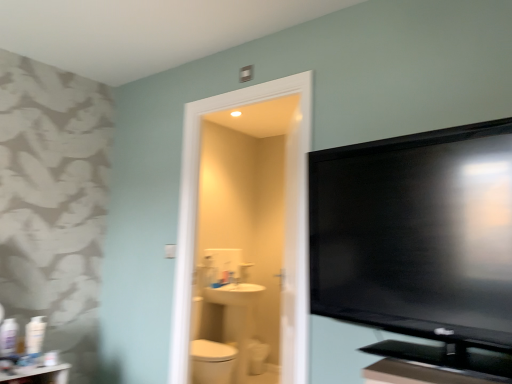
I want to click on white glossy toilet bowl at center, so (257, 356).

Identify the location of white plastic bottles at left, arranged as the second toiletry when viewed from the right. (8, 337).

Measure the distance between black glossy flat-screen tv at right and camera.

black glossy flat-screen tv at right is 1.14 meters from camera.

Measure the distance between point (494, 283) and camera.

Point (494, 283) is 3.83 feet away from camera.

In order to click on white glossy toilet bowl at center in this screenshot , I will do `click(257, 356)`.

Considering the sizes of white glossy toilet bowl at center and black glossy flat-screen tv at right in the image, is white glossy toilet bowl at center bigger or smaller than black glossy flat-screen tv at right?

Clearly, white glossy toilet bowl at center is smaller in size than black glossy flat-screen tv at right.

Is white glossy toilet bowl at center oriented towards black glossy flat-screen tv at right?

No, white glossy toilet bowl at center is not oriented towards black glossy flat-screen tv at right.

Is the surface of white glossy toilet bowl at center in direct contact with black glossy flat-screen tv at right?

No.

From a real-world perspective, between white plastic bottles at left, which appears as the 1th toiletry when viewed from the left, and white glossy sink at center, who is vertically higher?

From a 3D spatial view, white glossy sink at center is above.

Looking at this image, are white plastic bottles at left, arranged as the second toiletry when viewed from the right, and white glossy sink at center located far from each other?

That's right, there is a large distance between white plastic bottles at left, arranged as the second toiletry when viewed from the right, and white glossy sink at center.

Locate an element on the screen. The height and width of the screenshot is (384, 512). sink lying below the white plastic bottles at left, arranged as the second toiletry when viewed from the right (from the image's perspective) is located at coordinates click(x=232, y=292).

Which of these two, white plastic bottles at left, which appears as the 1th toiletry when viewed from the left, or white glossy sink at center, stands taller?

white plastic bottles at left, which appears as the 1th toiletry when viewed from the left.

In the image, is white plastic bottles at left, which appears as the 1th toiletry when viewed from the left, positioned in front of or behind white glossy toilet bowl at center?

Clearly, white plastic bottles at left, which appears as the 1th toiletry when viewed from the left, is in front of white glossy toilet bowl at center.

From a real-world perspective, is white plastic bottles at left, which appears as the 1th toiletry when viewed from the left, located beneath white glossy toilet bowl at center?

No, from a real-world perspective, white plastic bottles at left, which appears as the 1th toiletry when viewed from the left, is not below white glossy toilet bowl at center.

Who is bigger, white plastic bottles at left, arranged as the second toiletry when viewed from the right, or white glossy toilet bowl at center?

white glossy toilet bowl at center.

Identify the location of toilet bowl below the white plastic bottles at left, which appears as the 1th toiletry when viewed from the left (from a real-world perspective). Image resolution: width=512 pixels, height=384 pixels. (257, 356).

From the image's perspective, which one is positioned higher, white plastic bottles at left, which appears as the 1th toiletry when viewed from the left, or black glossy flat-screen tv at right?

A: black glossy flat-screen tv at right appears higher in the image.

Considering the positions of objects white plastic bottles at left, which appears as the 1th toiletry when viewed from the left, and black glossy flat-screen tv at right in the image provided, who is behind, white plastic bottles at left, which appears as the 1th toiletry when viewed from the left, or black glossy flat-screen tv at right?

white plastic bottles at left, which appears as the 1th toiletry when viewed from the left, is further away from the camera.

Considering the relative sizes of white plastic bottles at left, which appears as the 1th toiletry when viewed from the left, and black glossy flat-screen tv at right in the image provided, is white plastic bottles at left, which appears as the 1th toiletry when viewed from the left, shorter than black glossy flat-screen tv at right?

Yes.

From the image's perspective, which one is positioned higher, white glossy table at lower left or white glossy toilet bowl at center?

white glossy table at lower left appears higher in the image.

Is white glossy table at lower left wider or thinner than white glossy toilet bowl at center?

white glossy table at lower left is wider than white glossy toilet bowl at center.

Is white glossy table at lower left positioned behind white glossy toilet bowl at center?

No, the depth of white glossy table at lower left is less than that of white glossy toilet bowl at center.

Is white glossy table at lower left not close to white glossy toilet bowl at center?

Yes, white glossy table at lower left is far from white glossy toilet bowl at center.

Can you tell me how much white glossy sink at center and white plastic bottle at left, the 2th toiletry in the left-to-right sequence, differ in facing direction?

11.2 degrees separate the facing orientations of white glossy sink at center and white plastic bottle at left, the 2th toiletry in the left-to-right sequence.

How far apart are white glossy sink at center and white plastic bottle at left, the 1th toiletry from the right?

white glossy sink at center is 4.72 feet away from white plastic bottle at left, the 1th toiletry from the right.

From a real-world perspective, between white glossy sink at center and white plastic bottle at left, the 2th toiletry in the left-to-right sequence, who is vertically higher?

In real-world perspective, white glossy sink at center is above.

From the image's perspective, would you say white glossy sink at center is shown under white plastic bottle at left, the 1th toiletry from the right?

Indeed, from the image's perspective, white glossy sink at center is shown beneath white plastic bottle at left, the 1th toiletry from the right.

Is white glossy toilet bowl at center at the left side of white glossy table at lower left?

No.

From a real-world perspective, is white glossy toilet bowl at center below white glossy table at lower left?

Correct, in the physical world, white glossy toilet bowl at center is lower than white glossy table at lower left.

Is white glossy toilet bowl at center facing towards white glossy table at lower left?

Yes, white glossy toilet bowl at center is facing white glossy table at lower left.

Would you say white glossy toilet bowl at center is a long distance from white glossy table at lower left?

Yes, white glossy toilet bowl at center is far from white glossy table at lower left.

Find the location of a particular element. The height and width of the screenshot is (384, 512). toilet bowl behind the black glossy flat-screen tv at right is located at coordinates (257, 356).

From the image's perspective, count 2nd toiletrys upward from the white glossy sink at center and point to it. Please provide its 2D coordinates.

[(8, 337)]

Considering their positions, is black glossy flat-screen tv at right positioned closer to white plastic bottle at left, the 2th toiletry in the left-to-right sequence, than white glossy table at lower left?

Based on the image, white glossy table at lower left appears to be nearer to white plastic bottle at left, the 2th toiletry in the left-to-right sequence.

Based on their spatial positions, is white plastic bottle at left, the 2th toiletry in the left-to-right sequence, or white glossy table at lower left further from white plastic bottles at left, arranged as the second toiletry when viewed from the right?

white glossy table at lower left is further to white plastic bottles at left, arranged as the second toiletry when viewed from the right.

Which object lies nearer to the anchor point black glossy flat-screen tv at right, white glossy table at lower left or white plastic bottles at left, which appears as the 1th toiletry when viewed from the left?

white glossy table at lower left.

Based on their spatial positions, is white glossy toilet bowl at center or white plastic bottles at left, arranged as the second toiletry when viewed from the right, closer to white glossy table at lower left?

Among the two, white plastic bottles at left, arranged as the second toiletry when viewed from the right, is located nearer to white glossy table at lower left.

When comparing their distances from white plastic bottle at left, the 2th toiletry in the left-to-right sequence, does white glossy table at lower left or white glossy sink at center seem closer?

white glossy table at lower left lies closer to white plastic bottle at left, the 2th toiletry in the left-to-right sequence, than the other object.

Which object lies nearer to the anchor point white glossy toilet bowl at center, black glossy flat-screen tv at right or white glossy sink at center?

The object closer to white glossy toilet bowl at center is white glossy sink at center.

Considering their positions, is white plastic bottles at left, which appears as the 1th toiletry when viewed from the left, positioned further to white glossy table at lower left than black glossy flat-screen tv at right?

Based on the image, black glossy flat-screen tv at right appears to be further to white glossy table at lower left.

From the image, which object appears to be farther from white glossy toilet bowl at center, black glossy flat-screen tv at right or white plastic bottles at left, which appears as the 1th toiletry when viewed from the left?

black glossy flat-screen tv at right lies further to white glossy toilet bowl at center than the other object.

Identify the location of toiletry located between white plastic bottles at left, which appears as the 1th toiletry when viewed from the left, and white glossy sink at center in the left-right direction. This screenshot has width=512, height=384. (35, 335).

Identify the location of table between black glossy flat-screen tv at right and white glossy toilet bowl at center in the front-back direction. The image size is (512, 384). (36, 374).

You are a GUI agent. You are given a task and a screenshot of the screen. Output one action in this format:
    pyautogui.click(x=<x>, y=<y>)
    Task: Click on the toiletry between white glossy table at lower left and black glossy flat-screen tv at right
    
    Given the screenshot: What is the action you would take?
    pyautogui.click(x=35, y=335)

At what (x,y) coordinates should I click in order to perform the action: click on toiletry between white plastic bottles at left, arranged as the second toiletry when viewed from the right, and black glossy flat-screen tv at right, in the horizontal direction. Please return your answer as a coordinate pair (x, y). Looking at the image, I should click on (35, 335).